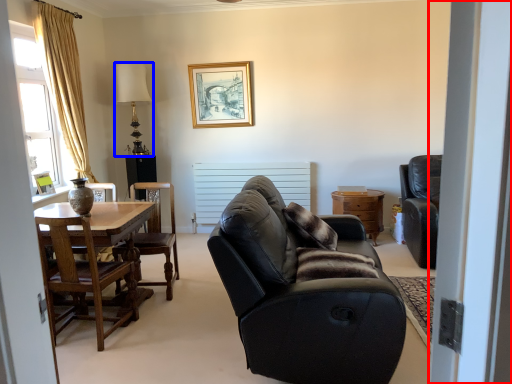
Question: Which point is further to the camera, screen door (highlighted by a red box) or lamp (highlighted by a blue box)?

Choices:
 (A) screen door
 (B) lamp

Answer: (B)